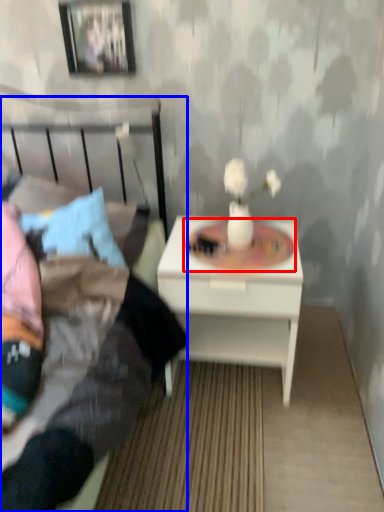
Question: Among these objects, which one is farthest to the camera, round table (highlighted by a red box) or bed (highlighted by a blue box)?

Choices:
 (A) round table
 (B) bed

Answer: (A)